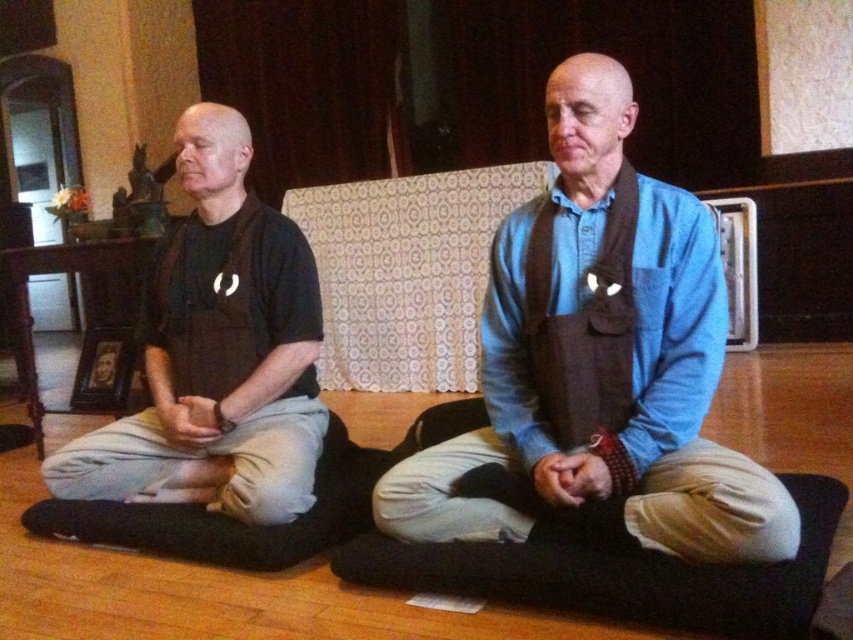
You are an observer sitting in front of the two individuals. Which individual is wearing the blue cotton shirt at center and is positioned to the right of the matte black shirt at left?

The blue cotton shirt at center is positioned on the right side of matte black shirt at left, so the individual wearing the blue cotton shirt at center is to the right of the matte black shirt at left.

You are standing in a room and see a blue cotton shirt at center. If you want to reach it without moving your feet, can you do it?

The blue cotton shirt at center is 4.35 feet from viewer, so if you can reach 4.35 feet or more without moving your feet, then yes, you can reach it.

Based on the photo, you are a photographer trying to capture a group photo of the blue cotton shirt at center and the matte black shirt at left. Since you want to ensure both shirts are fully visible in the frame, which shirt should you position closer to the camera to avoid cropping?

The blue cotton shirt at center is not as tall as the matte black shirt at left, so you should position the blue cotton shirt at center closer to the camera to ensure both shirts are fully visible in the frame.